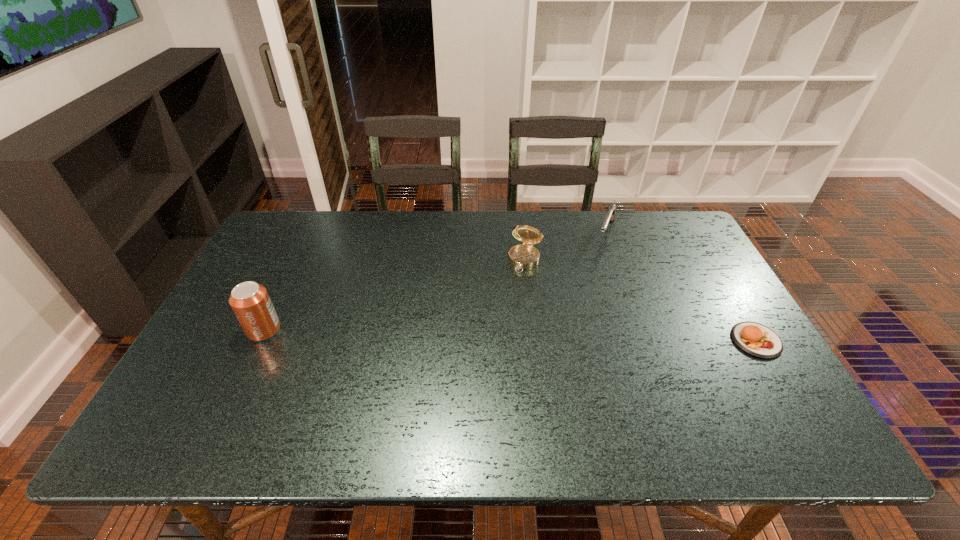
Image resolution: width=960 pixels, height=540 pixels. In order to click on can in this screenshot , I will do `click(250, 302)`.

Find the location of `the leftmost object`. the leftmost object is located at coordinates (250, 302).

Identify the location of patty (food). The image size is (960, 540). (758, 340).

Locate an element on the screen. The image size is (960, 540). the rightmost object is located at coordinates (758, 340).

The height and width of the screenshot is (540, 960). Find the location of `the third object from right to left`. the third object from right to left is located at coordinates (524, 256).

Where is `compass`? compass is located at coordinates (524, 256).

Locate an element on the screen. The image size is (960, 540). the second shortest object is located at coordinates (610, 216).

Identify the location of the second object from right to left. (610, 216).

Locate an element on the screen. free region located on the back of the can is located at coordinates (311, 232).

This screenshot has height=540, width=960. What are the coordinates of `vacant space located 0.330m on the back of the rightmost object` in the screenshot? It's located at (700, 246).